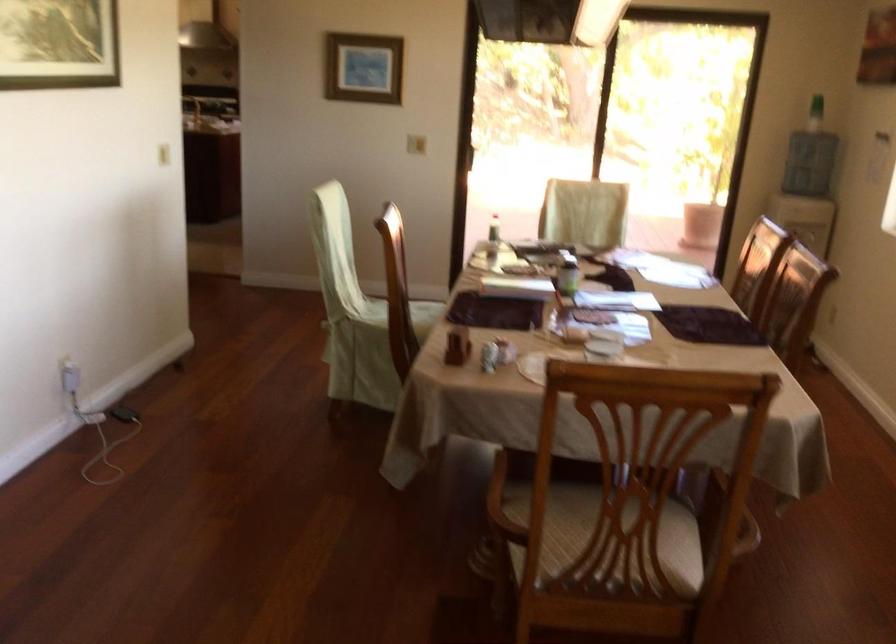
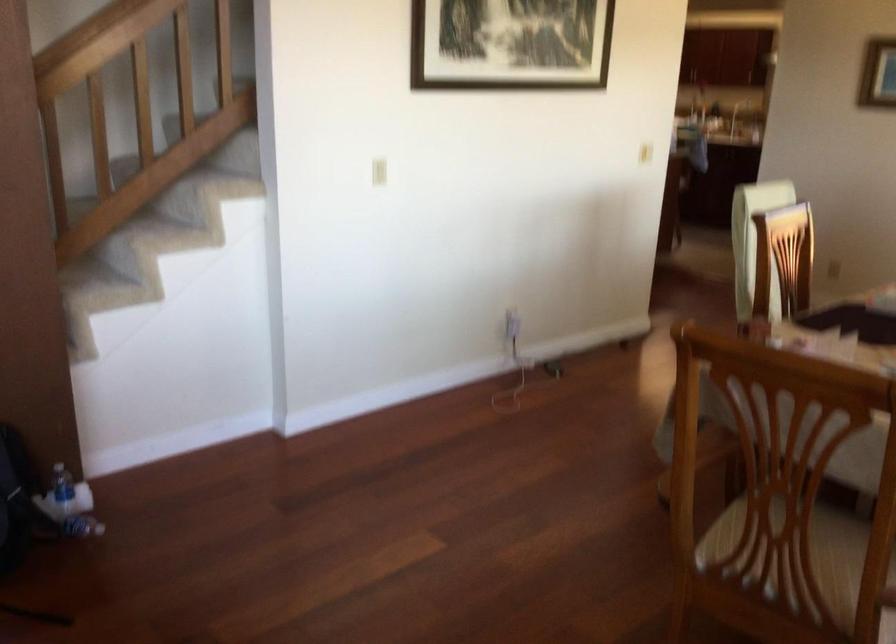
The point at [74,373] is marked in the first image. Where is the corresponding point in the second image?

(512, 323)